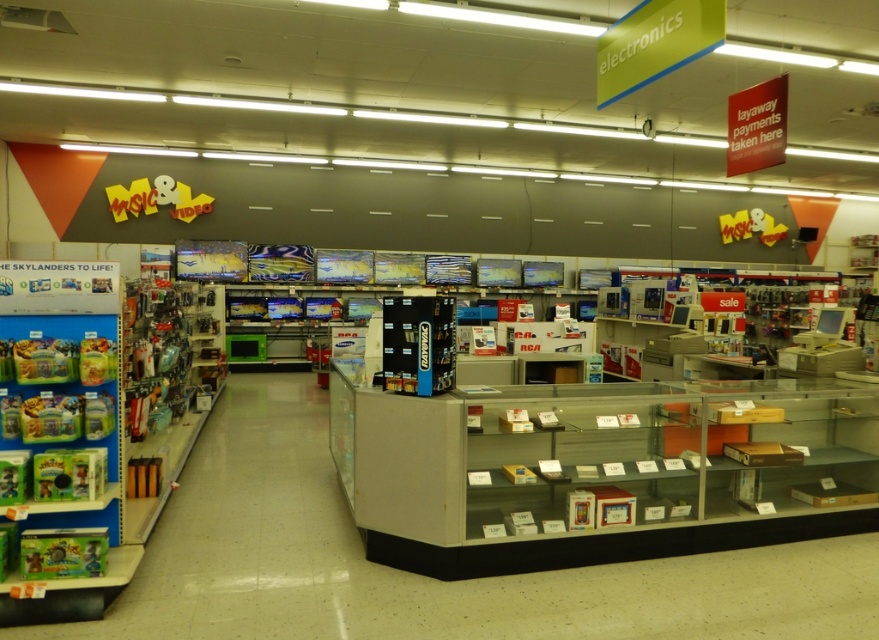
Question: Which point appears closest to the camera in this image?

Choices:
 (A) (115, 518)
 (B) (838, 442)

Answer: (A)

Question: Is clear plastic display case at center smaller than green plastic toy at left?

Choices:
 (A) yes
 (B) no

Answer: (B)

Question: Considering the relative positions of clear plastic display case at center and green plastic toy at left in the image provided, where is clear plastic display case at center located with respect to green plastic toy at left?

Choices:
 (A) below
 (B) above

Answer: (A)

Question: Does clear plastic display case at center have a larger size compared to green plastic toy at left?

Choices:
 (A) yes
 (B) no

Answer: (A)

Question: Which point is farther to the camera?

Choices:
 (A) green plastic toy at left
 (B) clear plastic display case at center

Answer: (B)